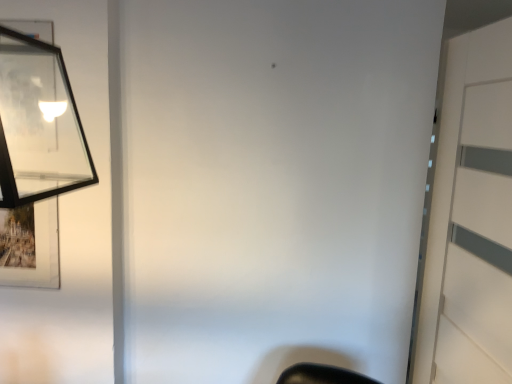
Describe the element at coordinates (469, 215) in the screenshot. I see `white matte door at right` at that location.

Measure the distance between point (465, 82) and camera.

Point (465, 82) and camera are 4.29 feet apart.

Locate an element on the screen. white matte door at right is located at coordinates (469, 215).

In order to face white matte door at right, should I rotate leftwards or rightwards?

You should rotate right by 27.596 degrees.

I want to click on white matte door at right, so click(469, 215).